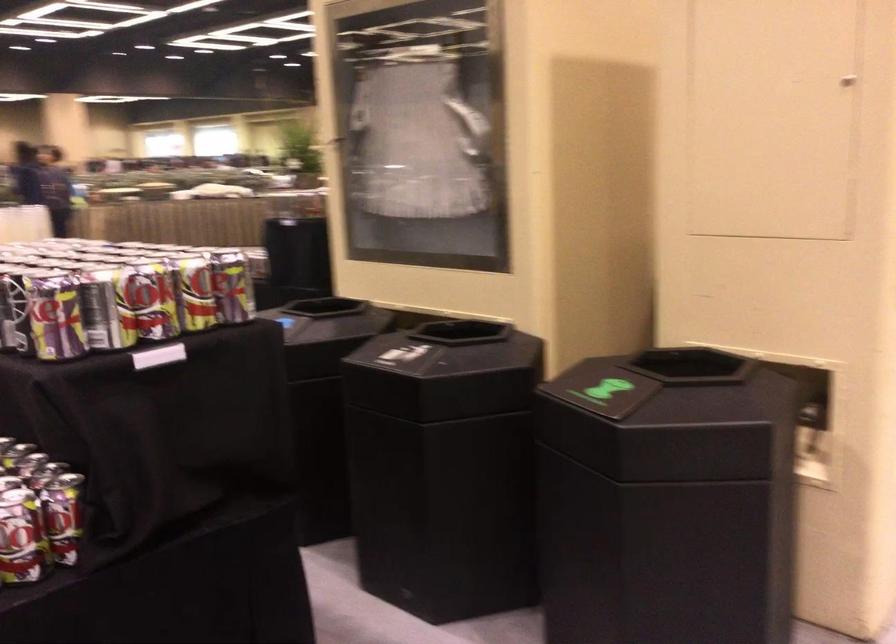
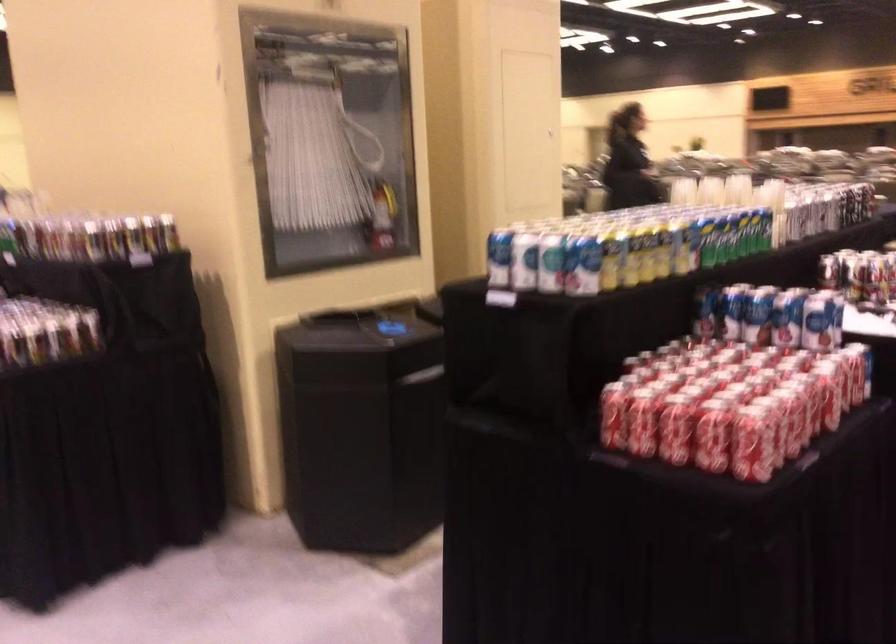
Find the pixel in the second image that matches point 510,228 in the first image.

(382, 216)